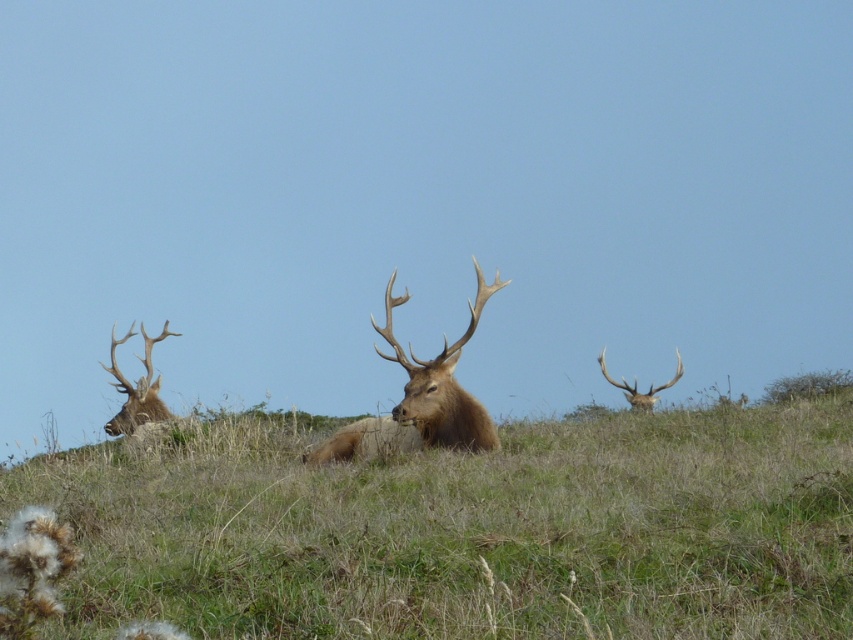
Question: Where is brown velvet antler at center located in relation to brown velvet antlers at left in the image?

Choices:
 (A) left
 (B) right

Answer: (B)

Question: Considering the real-world distances, which object is closest to the brown velvet antlers at left?

Choices:
 (A) brown velvet antler at upper right
 (B) green grass at center

Answer: (A)

Question: Can you confirm if brown velvet antler at center is positioned below brown velvet antlers at left?

Choices:
 (A) yes
 (B) no

Answer: (B)

Question: Which of these objects is positioned closest to the brown velvet antler at center?

Choices:
 (A) green grass at center
 (B) brown velvet antler at upper right

Answer: (A)

Question: Can you confirm if brown velvet antler at center is positioned above brown velvet antler at upper right?

Choices:
 (A) no
 (B) yes

Answer: (B)

Question: Which point appears closest to the camera in this image?

Choices:
 (A) (412, 422)
 (B) (601, 632)

Answer: (B)